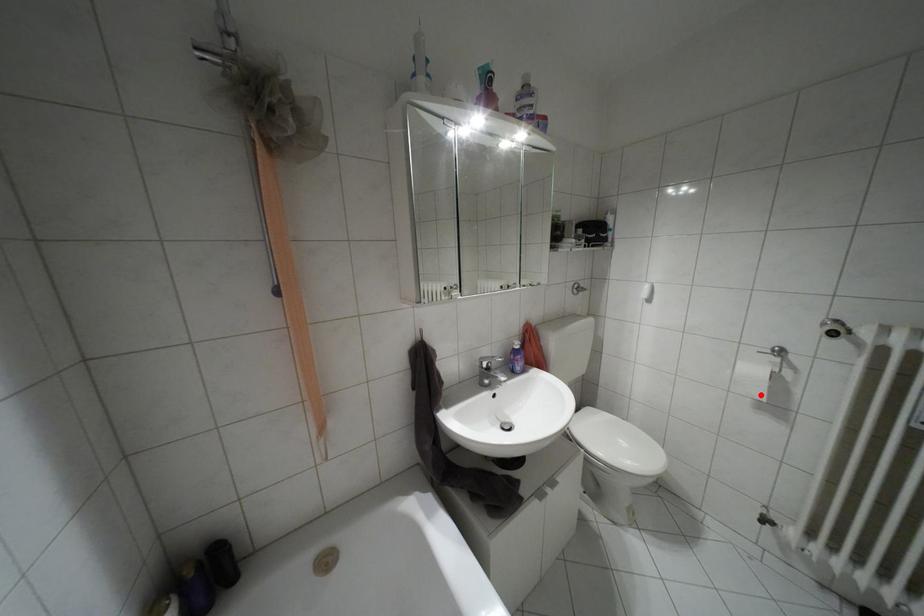
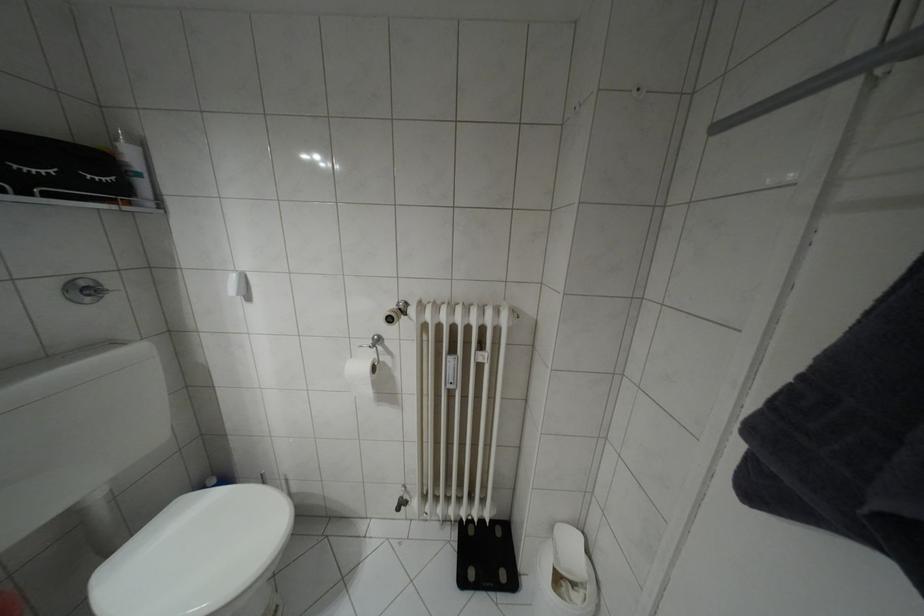
Locate, in the second image, the point that corresponds to the highlighted location in the first image.

(369, 392)